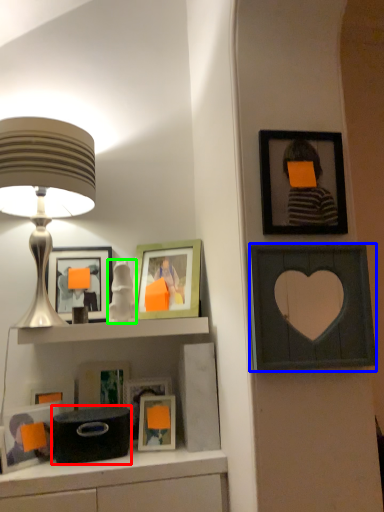
Question: Which is nearer to the box (highlighted by a red box)? picture frame (highlighted by a blue box) or toy (highlighted by a green box).

Choices:
 (A) picture frame
 (B) toy

Answer: (B)